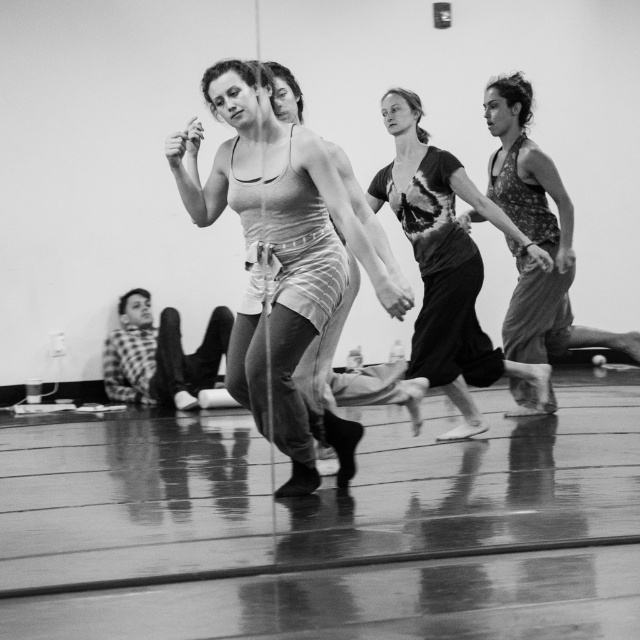
Between patterned fabric tank top at right and checkered fabric shirt at lower left, which one is positioned lower?

Positioned lower is checkered fabric shirt at lower left.

Locate an element on the screen. patterned fabric tank top at right is located at coordinates (536, 234).

The height and width of the screenshot is (640, 640). What are the coordinates of `patterned fabric tank top at right` in the screenshot? It's located at (536, 234).

Does printed cotton dress at center have a greater width compared to patterned fabric tank top at right?

Yes.

Is point (394, 108) less distant than point (545, 227)?

Yes, point (394, 108) is in front of point (545, 227).

Who is more forward, (429, 381) or (512, 140)?

Point (429, 381)

Where is `printed cotton dress at center`? printed cotton dress at center is located at coordinates (445, 264).

Is striped fabric tank top at center below checkered fabric shirt at lower left?

No.

Is point (252, 333) in front of point (147, 378)?

Yes, it is in front of point (147, 378).

This screenshot has height=640, width=640. I want to click on striped fabric tank top at center, so click(280, 259).